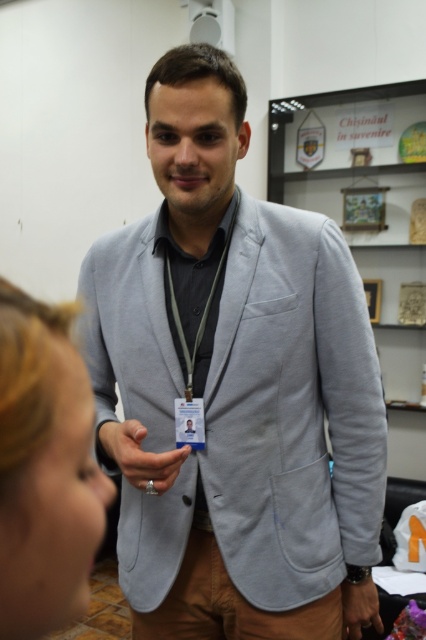
You are a photographer trying to capture both the silver metallic ring at center and the green fabric lanyard at center in a single shot. Since both are at the center, which one appears closer to the camera?

The silver metallic ring at center appears closer to the camera because it is shorter than the green fabric lanyard at center.